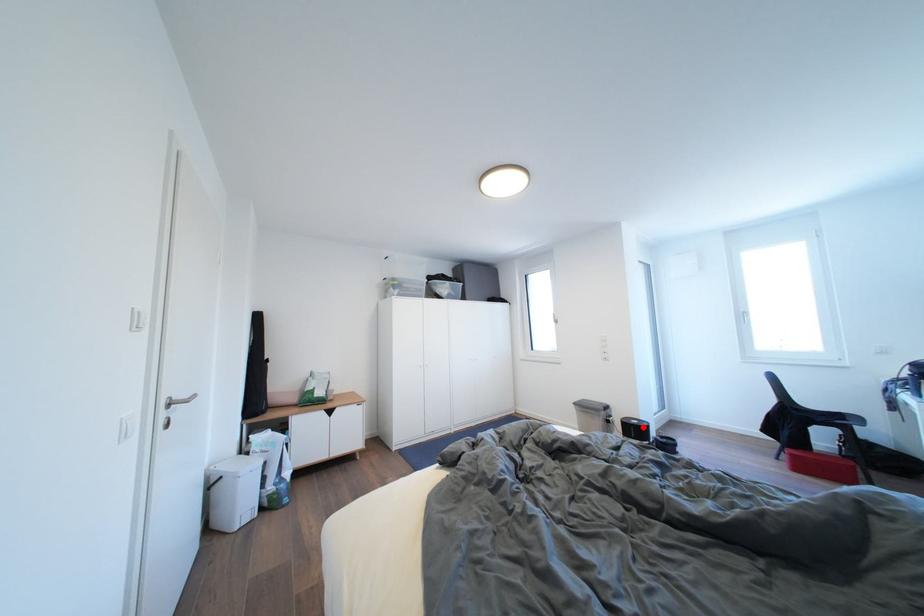
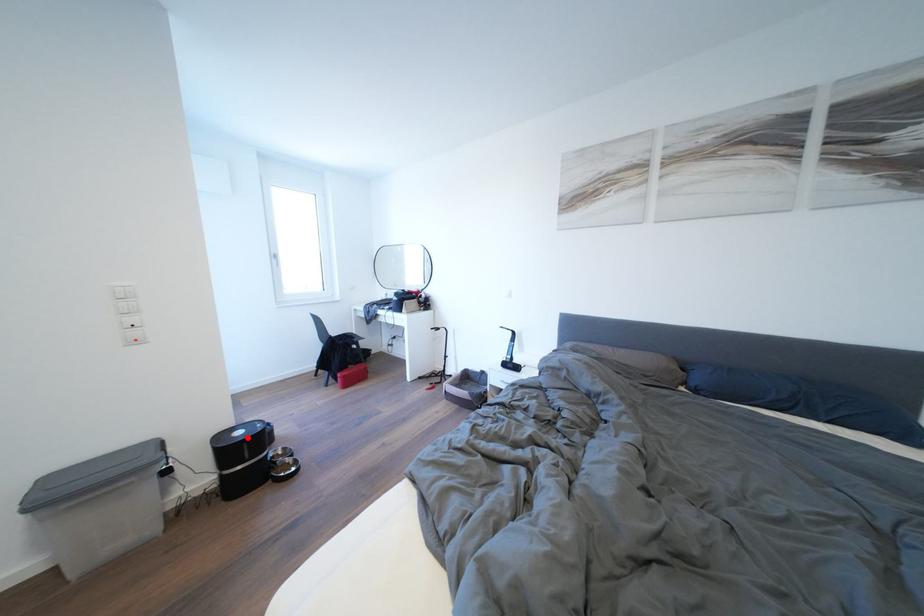
I am providing you with two images of the same scene from different viewpoints. A red point is marked on the first image and another point is marked on the second image. Is the red point in image1 aligned with the point shown in image2?

Yes